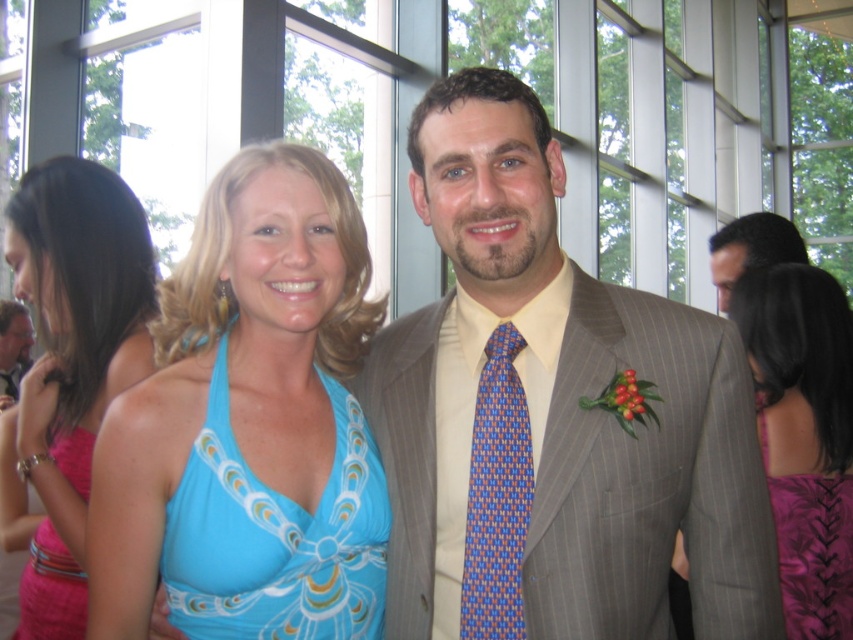
Is blue printed fabric dress at center smaller than blue woven tie at center?

Actually, blue printed fabric dress at center might be larger than blue woven tie at center.

Who is positioned more to the left, blue printed fabric dress at center or blue woven tie at center?

blue printed fabric dress at center

Is point (257, 634) less distant than point (508, 406)?

Yes, point (257, 634) is closer to viewer.

You are a GUI agent. You are given a task and a screenshot of the screen. Output one action in this format:
    pyautogui.click(x=<x>, y=<y>)
    Task: Click on the blue printed fabric dress at center
    The width and height of the screenshot is (853, 640).
    Given the screenshot: What is the action you would take?
    pyautogui.click(x=276, y=536)

Who is higher up, matte blue dress at center or pink satin dress at lower left?

matte blue dress at center is above.

The image size is (853, 640). I want to click on matte blue dress at center, so click(x=73, y=358).

Identify the location of matte blue dress at center. This screenshot has height=640, width=853. (73, 358).

Does blue printed fabric dress at center come in front of matte black suit at center?

Yes, blue printed fabric dress at center is closer to the viewer.

Locate an element on the screen. The image size is (853, 640). blue printed fabric dress at center is located at coordinates (276, 536).